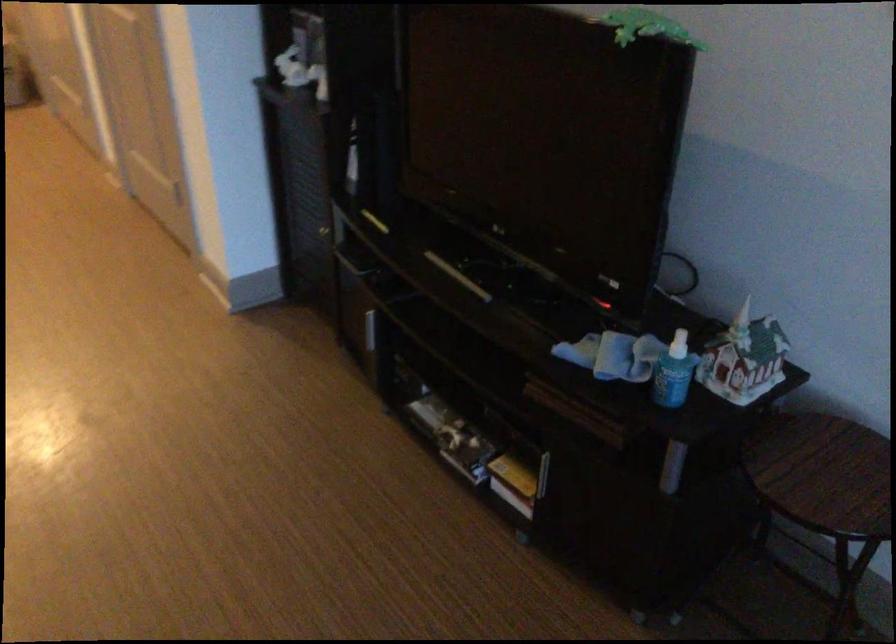
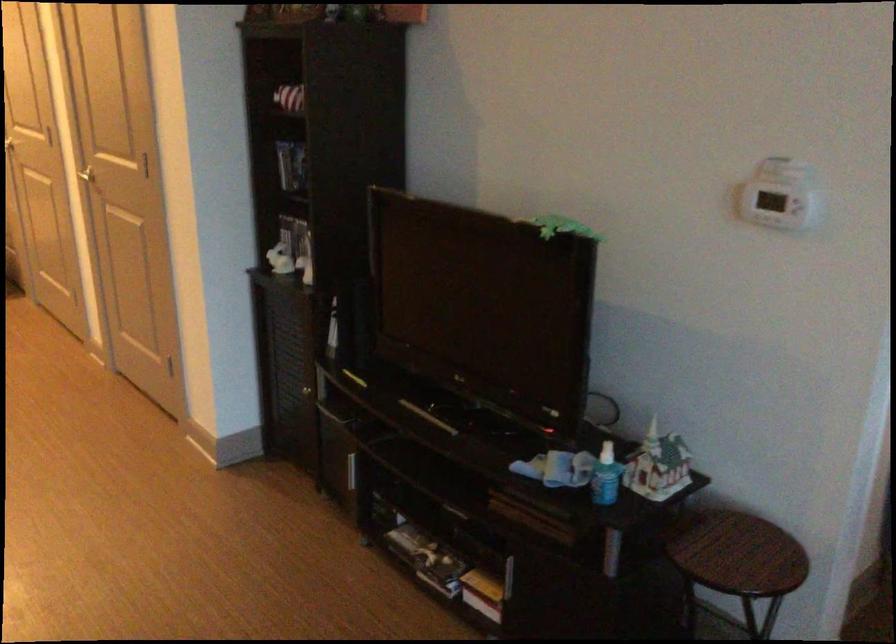
In the second image, find the point that corresponds to (825,464) in the first image.

(733, 547)